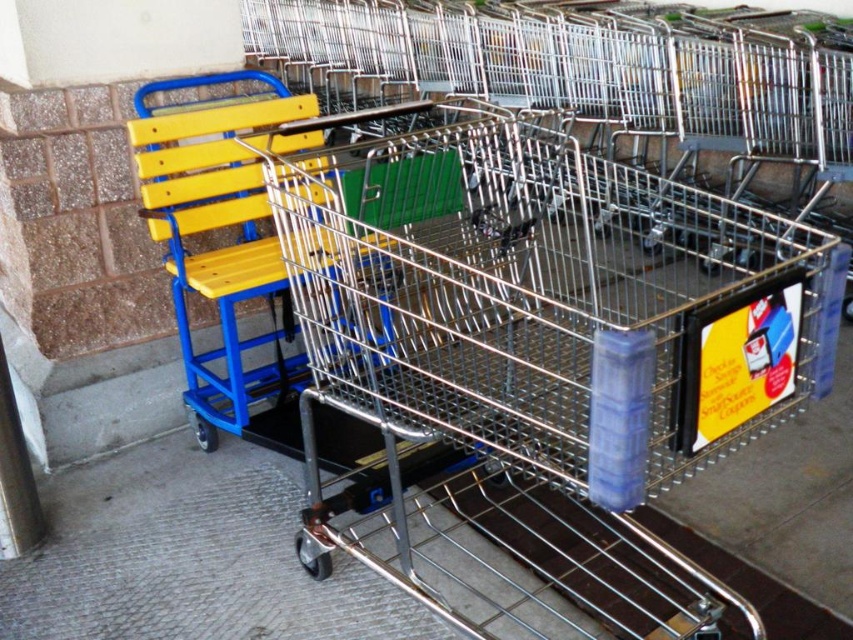
Question: Which object is closer to the camera taking this photo?

Choices:
 (A) metallic silver shopping cart at center
 (B) yellow wood chair at center

Answer: (A)

Question: Does metallic silver shopping cart at center have a greater width compared to yellow wood chair at center?

Choices:
 (A) no
 (B) yes

Answer: (B)

Question: Is metallic silver shopping cart at center to the right of yellow wood chair at center from the viewer's perspective?

Choices:
 (A) no
 (B) yes

Answer: (B)

Question: Is metallic silver shopping cart at center above yellow wood chair at center?

Choices:
 (A) yes
 (B) no

Answer: (A)

Question: Which object appears closest to the camera in this image?

Choices:
 (A) yellow wood chair at center
 (B) metallic silver shopping cart at center

Answer: (B)

Question: Which point appears closest to the camera in this image?

Choices:
 (A) (488, 113)
 (B) (227, 266)

Answer: (B)